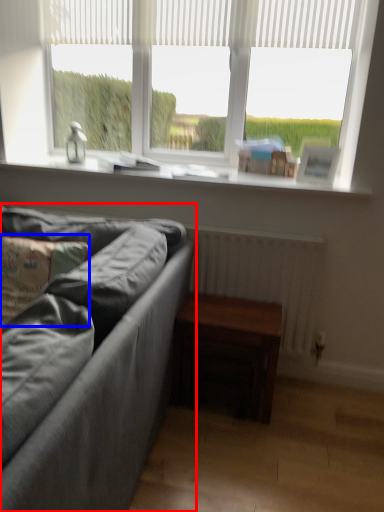
Question: Which of the following is the closest to the observer, studio couch (highlighted by a red box) or pillow (highlighted by a blue box)?

Choices:
 (A) studio couch
 (B) pillow

Answer: (A)